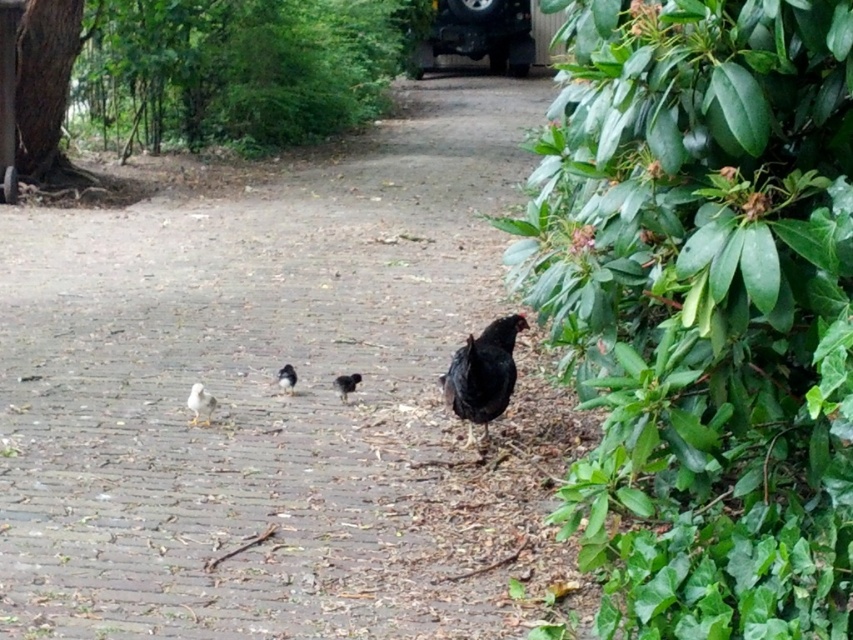
Question: Is green leafy tree at upper left bigger than black matte chicken at right?

Choices:
 (A) yes
 (B) no

Answer: (B)

Question: Can you confirm if brick pavement at center is thinner than green leafy bush at right?

Choices:
 (A) no
 (B) yes

Answer: (A)

Question: In this image, where is black matte chicken at center located relative to black glossy chicken at center?

Choices:
 (A) below
 (B) above

Answer: (A)

Question: Which of the following is the farthest from the observer?

Choices:
 (A) black matte chicken at center
 (B) green leafy bush at right
 (C) white fluffy chicken at lower left
 (D) brick pavement at center

Answer: (A)

Question: Which point is closer to the camera?

Choices:
 (A) green leafy bush at right
 (B) green leafy tree at upper left
 (C) black matte chicken at center
 (D) black matte chicken at right

Answer: (A)

Question: Which of the following is the closest to the observer?

Choices:
 (A) black matte chicken at right
 (B) green leafy bush at right

Answer: (B)